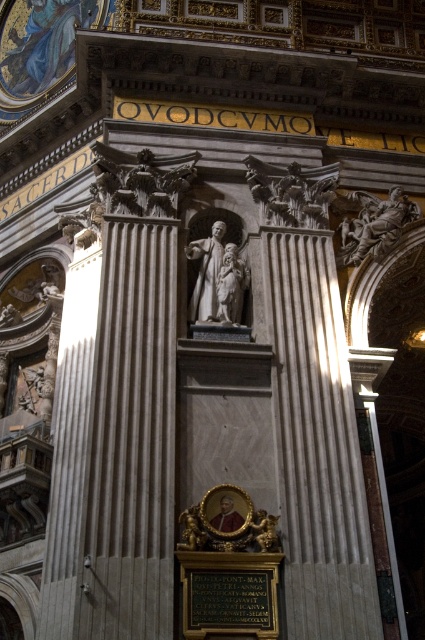
Can you confirm if white marble statue at center is positioned above polished marble statue at upper right?

Incorrect, white marble statue at center is not positioned above polished marble statue at upper right.

Where is `white marble statue at center`? The image size is (425, 640). white marble statue at center is located at coordinates (218, 278).

Where is `white marble statue at center`? The height and width of the screenshot is (640, 425). white marble statue at center is located at coordinates (218, 278).

Does carved stone angel at center have a larger size compared to polished marble statue at upper right?

No.

The width and height of the screenshot is (425, 640). I want to click on carved stone angel at center, so click(291, 193).

At what (x,y) coordinates should I click in order to perform the action: click on carved stone angel at center. Please return your answer as a coordinate pair (x, y). The image size is (425, 640). Looking at the image, I should click on (291, 193).

Locate an element on the screen. The image size is (425, 640). carved stone angel at center is located at coordinates (291, 193).

Is carved stone angel at center positioned in front of white marble statue at center?

No, it is behind white marble statue at center.

Locate an element on the screen. carved stone angel at center is located at coordinates (291, 193).

Find the location of a particular element. This screenshot has height=640, width=425. carved stone angel at center is located at coordinates pyautogui.click(x=291, y=193).